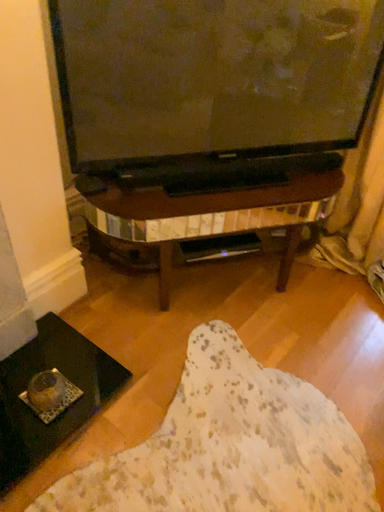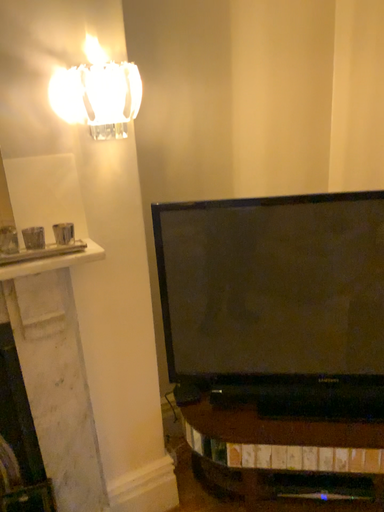
Question: Which way did the camera rotate in the video?

Choices:
 (A) rotated right
 (B) rotated left

Answer: (B)